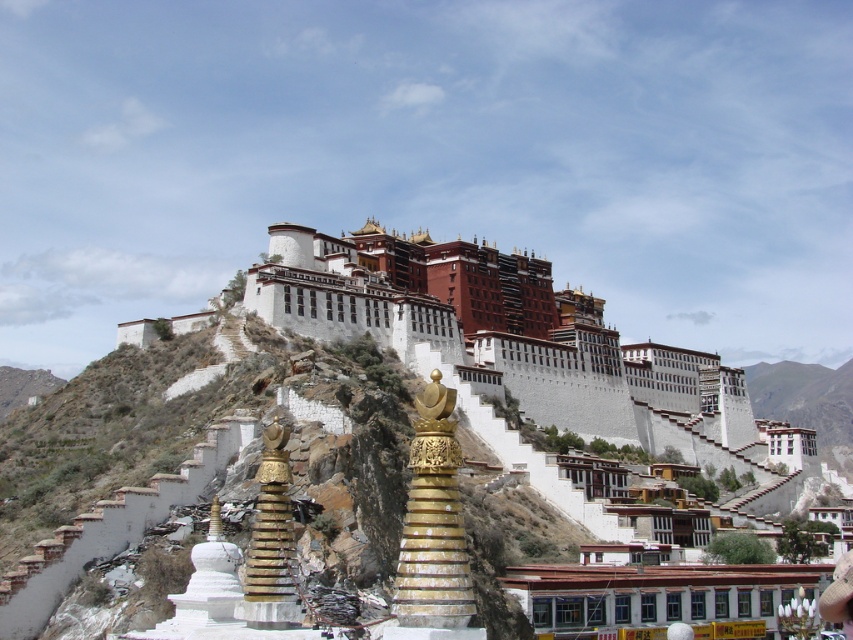
Question: Can you confirm if white stone building at upper center is positioned below gold polished stupa at center?

Choices:
 (A) no
 (B) yes

Answer: (A)

Question: Which object is the farthest from the gold metallic stupa at center?

Choices:
 (A) gold polished stupa at center
 (B) white stone building at upper center

Answer: (B)

Question: Can you confirm if gold polished stupa at center is positioned to the right of gold metallic stupa at center?

Choices:
 (A) yes
 (B) no

Answer: (A)

Question: Among these objects, which one is farthest from the camera?

Choices:
 (A) gold metallic stupa at center
 (B) gold polished stupa at center
 (C) white stone building at upper center

Answer: (C)

Question: Is gold polished stupa at center wider than gold metallic stupa at center?

Choices:
 (A) no
 (B) yes

Answer: (A)

Question: Which of the following is the farthest from the observer?

Choices:
 (A) (277, 420)
 (B) (294, 284)
 (C) (459, 556)

Answer: (B)